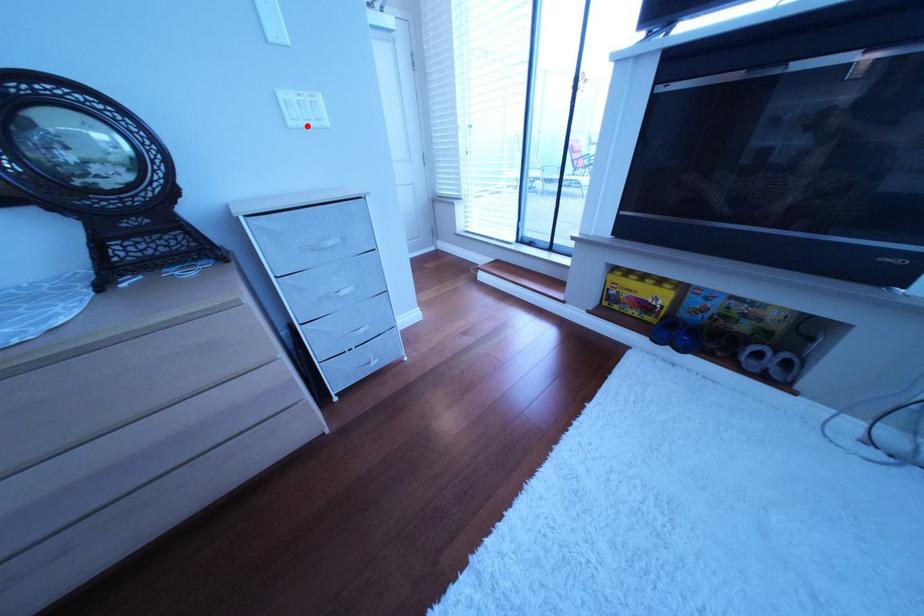
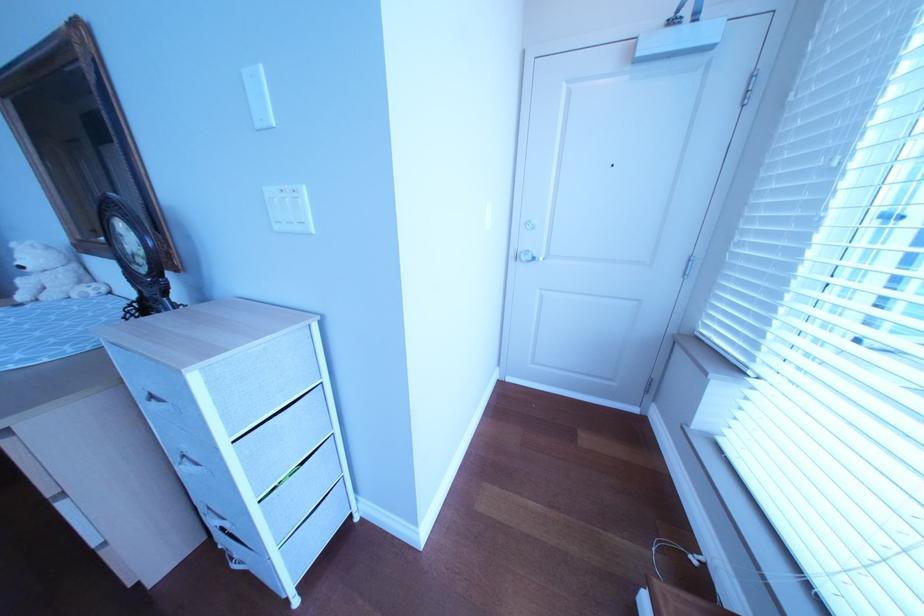
The point at the highlighted location is marked in the first image. Where is the corresponding point in the second image?

(292, 229)